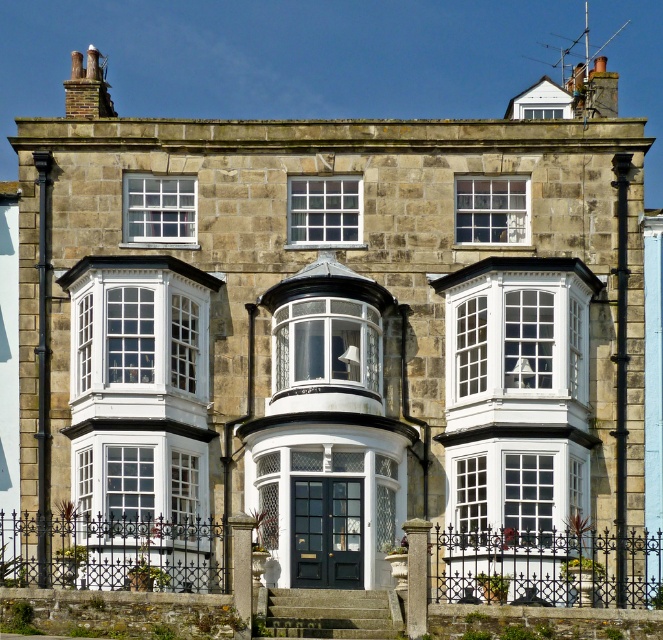
Question: Is white glass window at upper left wider than clear glass window at upper center?

Choices:
 (A) no
 (B) yes

Answer: (B)

Question: Is clear glass bay window at center in front of white glass window at upper left?

Choices:
 (A) no
 (B) yes

Answer: (B)

Question: Which point appears closest to the camera in this image?

Choices:
 (A) (353, 348)
 (B) (125, 227)
 (C) (552, 104)

Answer: (A)

Question: Considering the real-world distances, which object is farthest from the white glass window at upper center?

Choices:
 (A) white glass window at upper left
 (B) clear glass window at upper center
 (C) clear glass bay window at center
 (D) white wood window at center

Answer: (B)

Question: Which object appears farthest from the camera in this image?

Choices:
 (A) white glass window at upper center
 (B) white glass window at upper left
 (C) white wood window at center

Answer: (C)

Question: Is white glass window at upper left bigger than clear glass window at upper center?

Choices:
 (A) yes
 (B) no

Answer: (B)